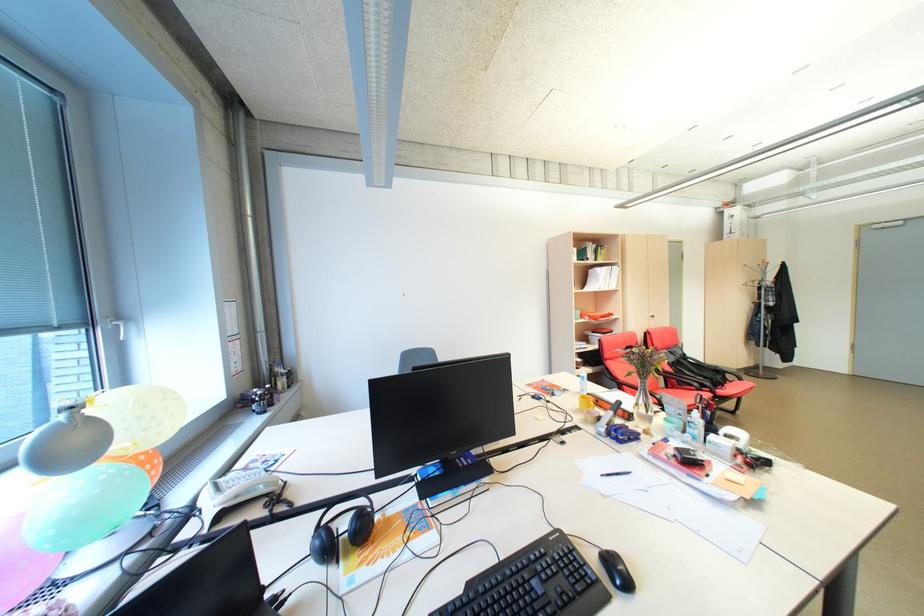
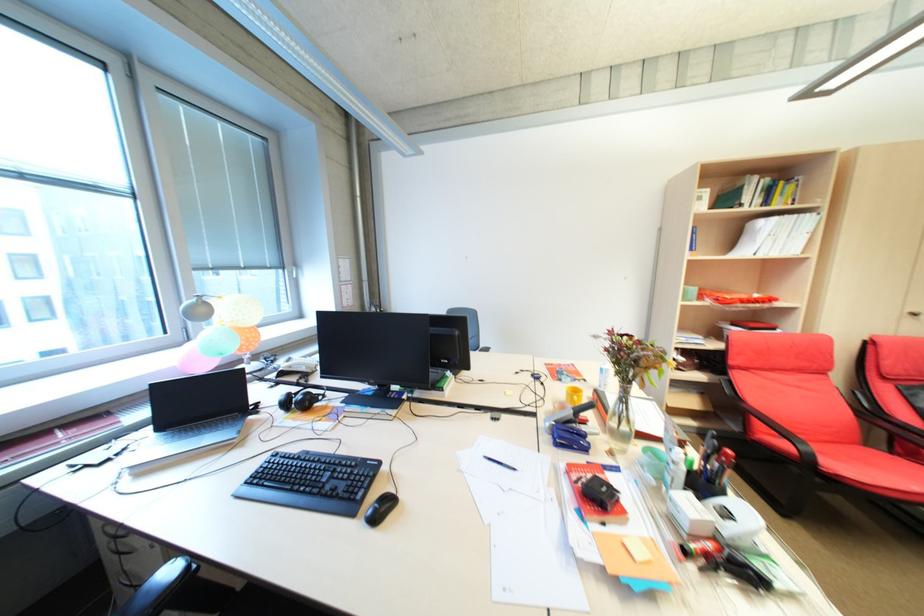
Locate, in the second image, the point that corresponds to [646,406] in the first image.

(623, 416)